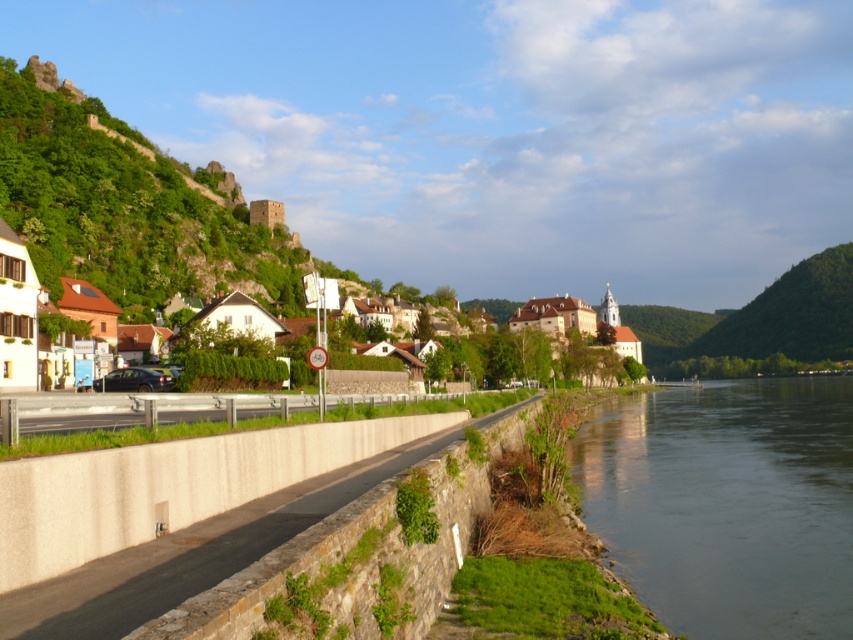
Who is lower down, green grassy riverbank at lower right or white matte houses at center?

green grassy riverbank at lower right is below.

Is point (772, 621) closer to viewer compared to point (570, 349)?

Yes, point (772, 621) is in front of point (570, 349).

Does point (822, 616) come farther from viewer compared to point (560, 308)?

No, (822, 616) is in front of (560, 308).

Locate an element on the screen. This screenshot has width=853, height=640. green grassy riverbank at lower right is located at coordinates (727, 502).